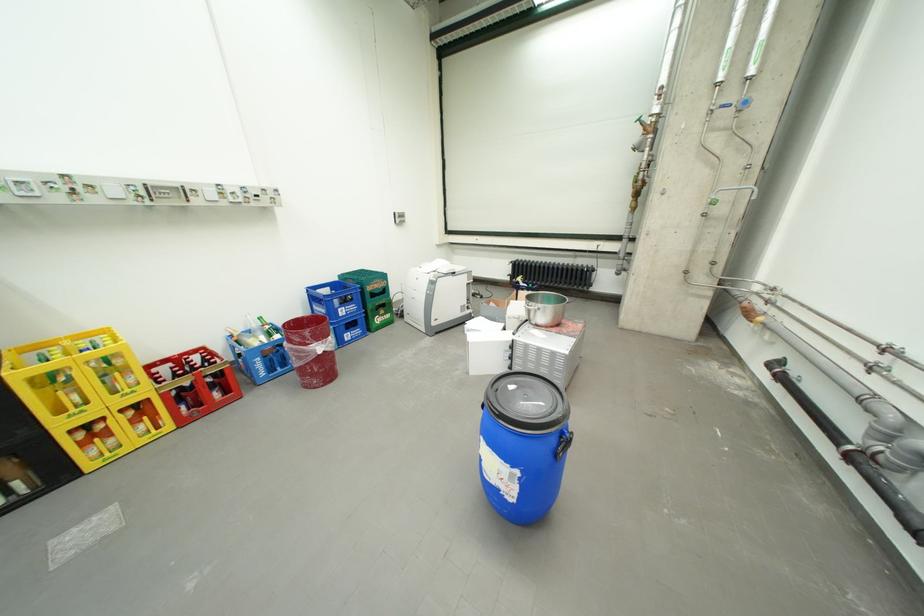
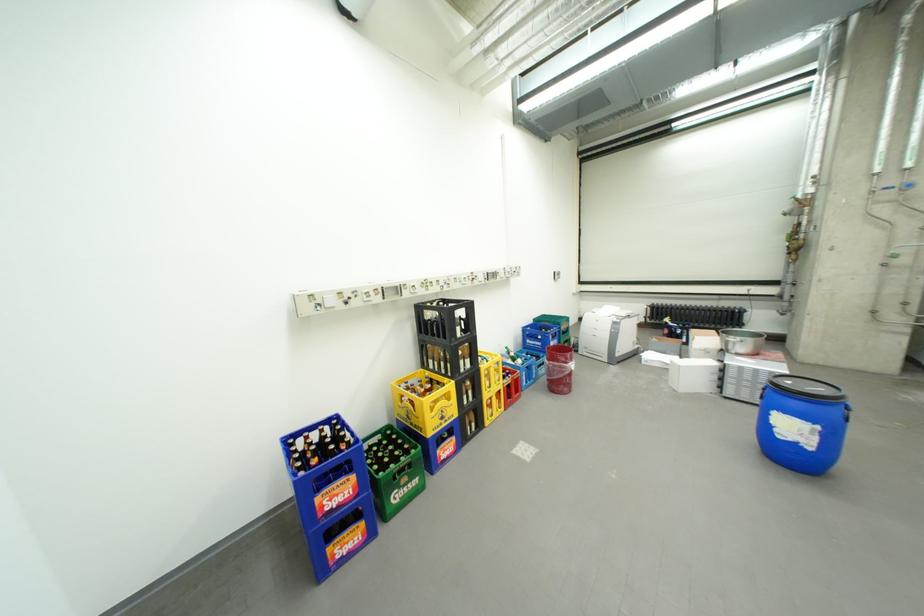
Where in the second image is the point corresponding to pixel 349 310 from the first image?

(562, 344)